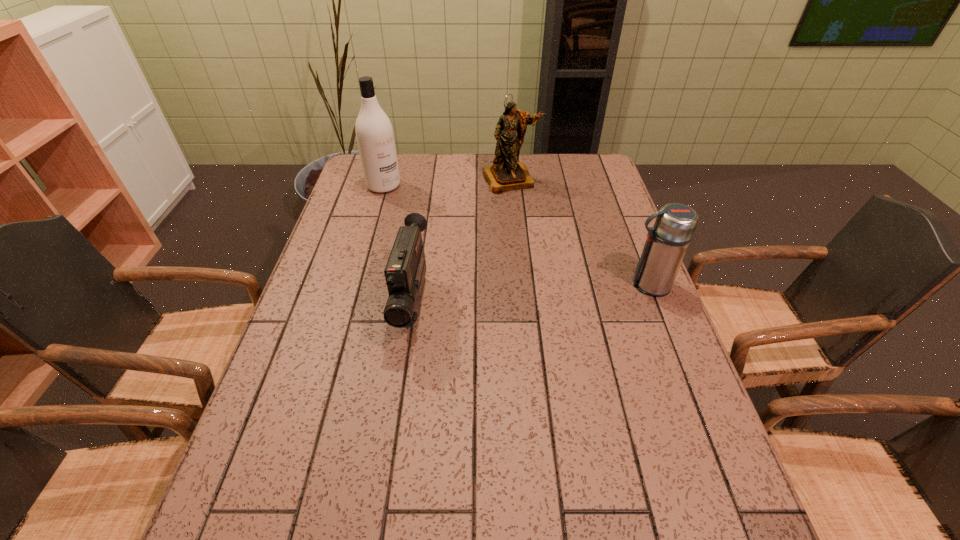
Locate an element on the screen. the shortest object is located at coordinates (405, 270).

Find the location of a particular element. This screenshot has width=960, height=540. the third object from right to left is located at coordinates (405, 270).

This screenshot has width=960, height=540. I want to click on the rightmost object, so click(667, 241).

At what (x,y) coordinates should I click in order to perform the action: click on the third tallest object. Please return your answer as a coordinate pair (x, y). This screenshot has height=540, width=960. Looking at the image, I should click on (667, 241).

Find the location of a particular element. the third object from left to right is located at coordinates (506, 174).

Identify the location of figurine. (506, 174).

At what (x,y) coordinates should I click in order to perform the action: click on shampoo. Please return your answer as a coordinate pair (x, y). The image size is (960, 540). Looking at the image, I should click on (374, 132).

Find the location of a particular element. the leftmost object is located at coordinates (374, 132).

This screenshot has width=960, height=540. I want to click on free spot located on the front-facing side of the second object from left to right, so [398, 403].

Identify the location of free space located 0.380m with a handle on the side of the thermos bottle. (484, 285).